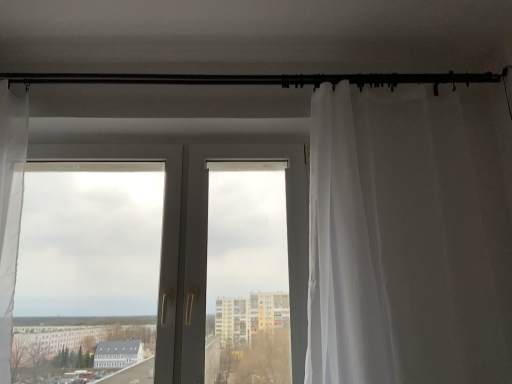
Question: Considering the relative sizes of sheer white curtain at right and white plastic door at center in the image provided, is sheer white curtain at right wider than white plastic door at center?

Choices:
 (A) no
 (B) yes

Answer: (B)

Question: From a real-world perspective, is sheer white curtain at right located beneath white plastic door at center?

Choices:
 (A) no
 (B) yes

Answer: (A)

Question: Considering the relative positions of sheer white curtain at right and white plastic door at center in the image provided, is sheer white curtain at right behind white plastic door at center?

Choices:
 (A) yes
 (B) no

Answer: (B)

Question: Is sheer white curtain at right oriented towards white plastic door at center?

Choices:
 (A) yes
 (B) no

Answer: (B)

Question: Is sheer white curtain at right to the right of white plastic door at center from the viewer's perspective?

Choices:
 (A) no
 (B) yes

Answer: (B)

Question: Based on their sizes in the image, would you say sheer white curtain at right is bigger or smaller than black metal rod at upper center?

Choices:
 (A) big
 (B) small

Answer: (A)

Question: Is sheer white curtain at right inside the boundaries of black metal rod at upper center, or outside?

Choices:
 (A) inside
 (B) outside

Answer: (B)

Question: Is sheer white curtain at right in front of or behind black metal rod at upper center in the image?

Choices:
 (A) front
 (B) behind

Answer: (A)

Question: Considering the positions of point (510, 289) and point (390, 77), is point (510, 289) closer or farther from the camera than point (390, 77)?

Choices:
 (A) farther
 (B) closer

Answer: (B)

Question: In terms of width, does white plastic door at center look wider or thinner when compared to sheer white curtain at right?

Choices:
 (A) wide
 (B) thin

Answer: (B)

Question: In the image, is white plastic door at center positioned in front of or behind sheer white curtain at right?

Choices:
 (A) behind
 (B) front

Answer: (A)

Question: From the image's perspective, is white plastic door at center positioned above or below sheer white curtain at right?

Choices:
 (A) below
 (B) above

Answer: (A)

Question: In terms of height, does white plastic door at center look taller or shorter compared to sheer white curtain at right?

Choices:
 (A) short
 (B) tall

Answer: (A)

Question: Is point (360, 79) positioned closer to the camera than point (393, 268)?

Choices:
 (A) closer
 (B) farther

Answer: (B)

Question: In terms of height, does black metal rod at upper center look taller or shorter compared to sheer white curtain at right?

Choices:
 (A) short
 (B) tall

Answer: (A)